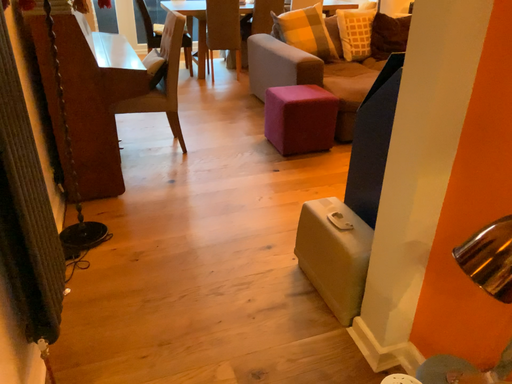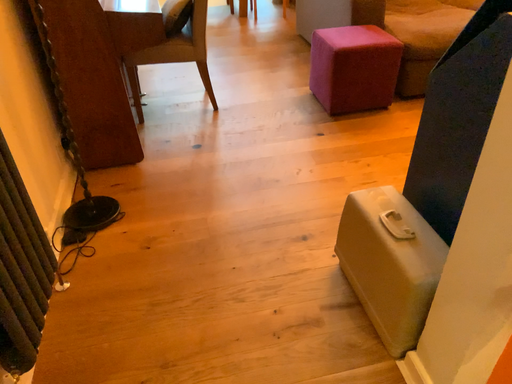
Question: How did the camera likely rotate when shooting the video?

Choices:
 (A) rotated upward
 (B) rotated downward

Answer: (B)